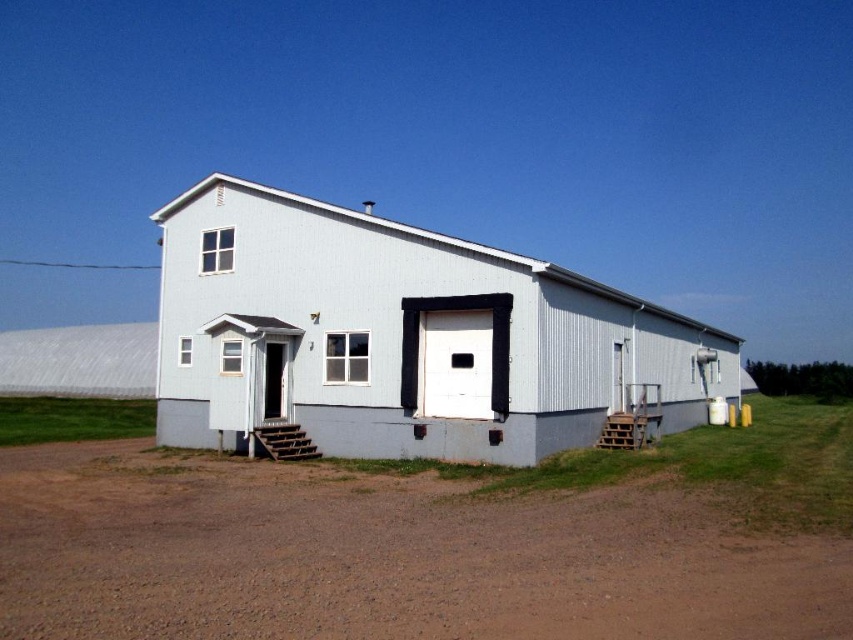
Question: Estimate the real-world distances between objects in this image. Which object is farther from the light blue siding at center?

Choices:
 (A) white matte garage door at center
 (B) brown dirt field at lower center

Answer: (B)

Question: Does brown dirt field at lower center have a smaller size compared to light blue siding at center?

Choices:
 (A) no
 (B) yes

Answer: (B)

Question: Can you confirm if brown dirt field at lower center is thinner than light blue siding at center?

Choices:
 (A) yes
 (B) no

Answer: (B)

Question: Which object appears farthest from the camera in this image?

Choices:
 (A) white matte garage door at center
 (B) brown dirt field at lower center
 (C) light blue siding at center

Answer: (A)

Question: Is brown dirt field at lower center smaller than light blue siding at center?

Choices:
 (A) yes
 (B) no

Answer: (A)

Question: Which point is farther from the camera taking this photo?

Choices:
 (A) (107, 480)
 (B) (473, 355)
 (C) (439, 420)

Answer: (C)